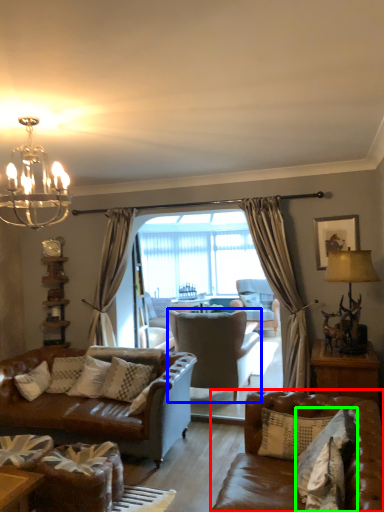
Question: Which object is the closest to the studio couch (highlighted by a red box)? Choose among these: chair (highlighted by a blue box) or pillow (highlighted by a green box).

Choices:
 (A) chair
 (B) pillow

Answer: (B)